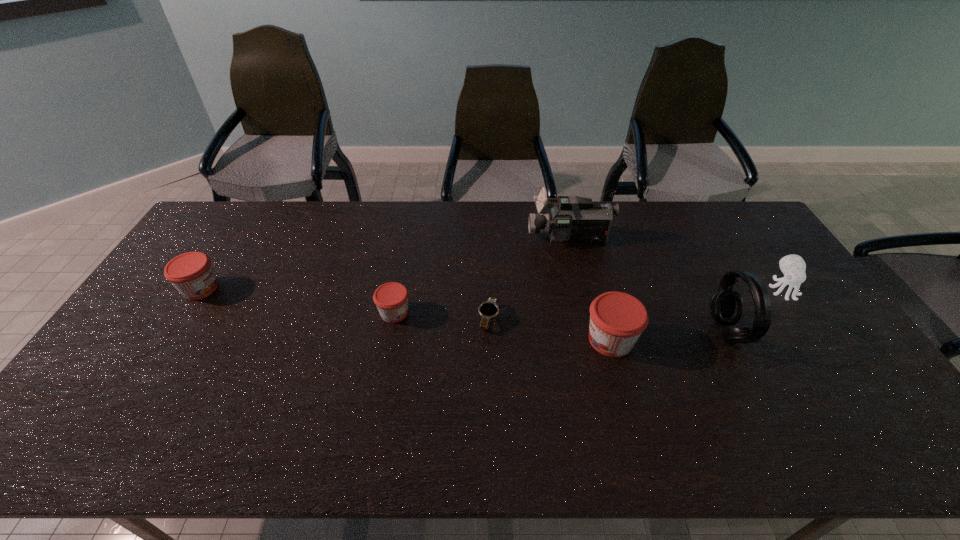
Find the location of a particular element. This screenshot has width=960, height=540. vacant space positioned on the front-facing side of the farthest object is located at coordinates (457, 238).

This screenshot has width=960, height=540. Identify the location of vacant space located 0.190m on the front-facing side of the farthest object. (474, 238).

Image resolution: width=960 pixels, height=540 pixels. I want to click on vacant region located 0.070m on the left of the watch, so click(x=453, y=319).

You are a GUI agent. You are given a task and a screenshot of the screen. Output one action in this format:
    pyautogui.click(x=<x>, y=<y>)
    Task: Click on the object at the far edge
    The width and height of the screenshot is (960, 540).
    Given the screenshot: What is the action you would take?
    pyautogui.click(x=573, y=219)

Identify the location of object that is at the left edge. This screenshot has width=960, height=540. pyautogui.click(x=191, y=273).

This screenshot has height=540, width=960. What are the coordinates of `object situated at the right edge` in the screenshot? It's located at (793, 267).

Locate an element on the screen. The width and height of the screenshot is (960, 540). free region at the far edge is located at coordinates (707, 242).

You are a GUI agent. You are given a task and a screenshot of the screen. Output one action in this format:
    pyautogui.click(x=<x>, y=<y>)
    Task: Click on the free space at the near edge of the desktop
    The image size is (960, 540).
    Given the screenshot: What is the action you would take?
    pyautogui.click(x=407, y=387)

The image size is (960, 540). I want to click on vacant space at the left edge, so click(x=178, y=334).

In the image, there is a desktop. In order to click on vacant space at the far left corner in this screenshot , I will do `click(214, 213)`.